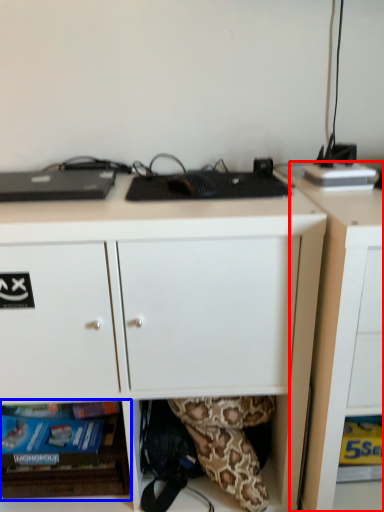
Question: Among these objects, which one is nearest to the camera, cabinetry (highlighted by a red box) or shelf (highlighted by a blue box)?

Choices:
 (A) cabinetry
 (B) shelf

Answer: (A)